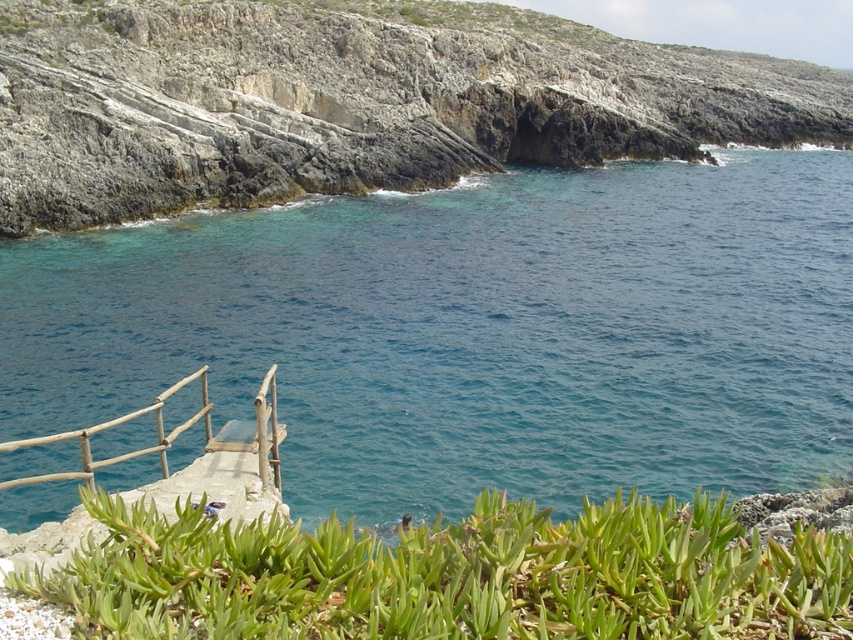
You are standing on the small concrete platform with wooden railings at the edge of the cliff. You want to jump into the blue water at upper center. Considering the safety guidelines that recommend a minimum of 15 meters for safe cliff diving, is this location safe for diving?

The distance between you and the blue water at upper center is 14.95 meters, which is just below the recommended 15 meters for safe cliff diving. Therefore, this location may not be safe for diving.

You are standing on the coastal platform and want to place a small potted plant that is 30 cm tall. The green succulent at lower center and the wooden rail at lower left are in your way. Which object is taller and might block your view if you place the plant there?

The green succulent at lower center is much taller than the wooden rail at lower left, so placing the 30 cm tall potted plant there might be blocked by the green succulent at lower center.

You are planning to take a photo of the blue water at upper center and the green succulent at lower center. Which object should you focus on first if you want to capture both in one frame without moving the camera?

You should focus on the blue water at upper center first because it is larger than the green succulent at lower center, making it the primary subject for the frame.